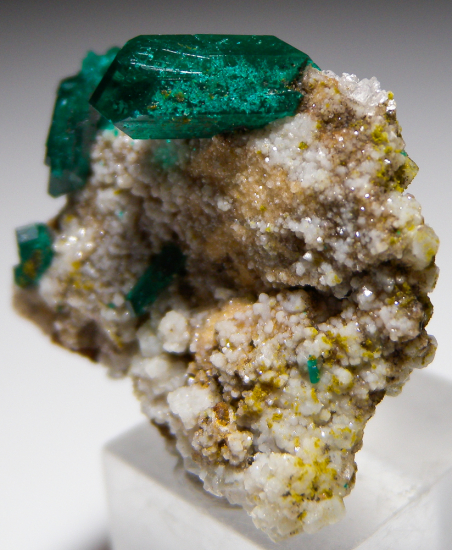
Find the location of a particular element. The image size is (452, 550). floor is located at coordinates (75, 495).